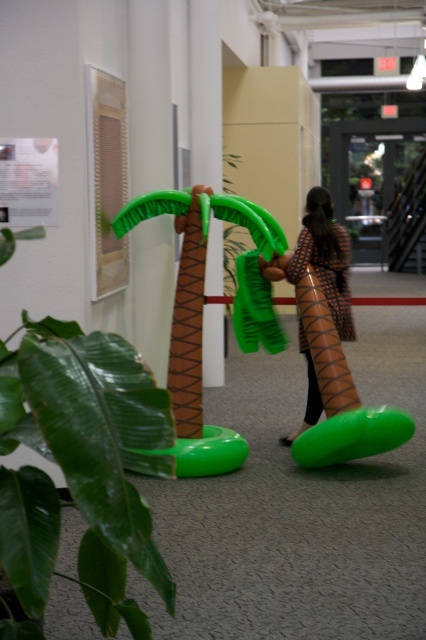
Question: Which object appears closest to the camera in this image?

Choices:
 (A) green rubber plant at left
 (B) brown textured dress at center

Answer: (A)

Question: Is green rubber plant at left above brown textured dress at center?

Choices:
 (A) no
 (B) yes

Answer: (A)

Question: Is green rubber plant at left thinner than brown textured dress at center?

Choices:
 (A) no
 (B) yes

Answer: (B)

Question: Among these objects, which one is nearest to the camera?

Choices:
 (A) green rubber plant at left
 (B) brown textured dress at center

Answer: (A)

Question: Is green rubber plant at left further to the viewer compared to brown textured dress at center?

Choices:
 (A) no
 (B) yes

Answer: (A)

Question: Which point is farther from the camera taking this photo?

Choices:
 (A) (123, 492)
 (B) (313, 396)

Answer: (B)